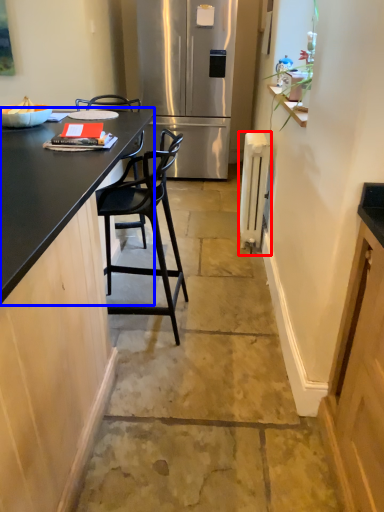
Question: Among these objects, which one is farthest to the camera, appliance (highlighted by a red box) or countertop (highlighted by a blue box)?

Choices:
 (A) appliance
 (B) countertop

Answer: (A)